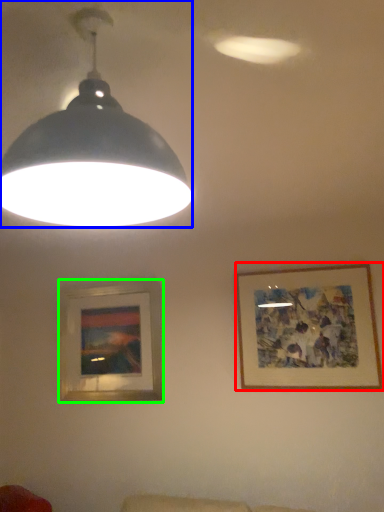
Question: Considering the real-world distances, which object is closest to picture frame (highlighted by a red box)? lamp (highlighted by a blue box) or picture frame (highlighted by a green box).

Choices:
 (A) lamp
 (B) picture frame

Answer: (B)